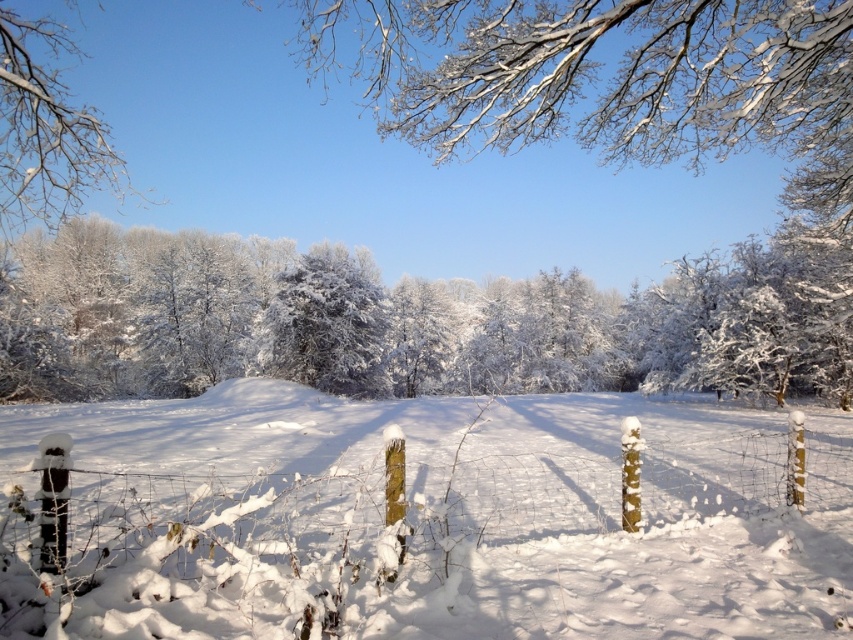
Question: Which point is farther to the camera?

Choices:
 (A) white frosty trees at center
 (B) white frosty branches at upper left

Answer: (A)

Question: Among these points, which one is nearest to the camera?

Choices:
 (A) (315, 538)
 (B) (73, 163)
 (C) (157, 256)

Answer: (A)

Question: Does snow-covered wooden posts at center have a greater width compared to white frosty branches at upper left?

Choices:
 (A) no
 (B) yes

Answer: (A)

Question: Based on their relative distances, which object is nearer to the white frosty branches at upper left?

Choices:
 (A) snow-covered wooden posts at center
 (B) white frosty trees at center

Answer: (A)

Question: Does snow-covered wooden posts at center have a greater width compared to white frosty trees at center?

Choices:
 (A) no
 (B) yes

Answer: (A)

Question: Does white frosty trees at center have a smaller size compared to white frosty branches at upper left?

Choices:
 (A) yes
 (B) no

Answer: (A)